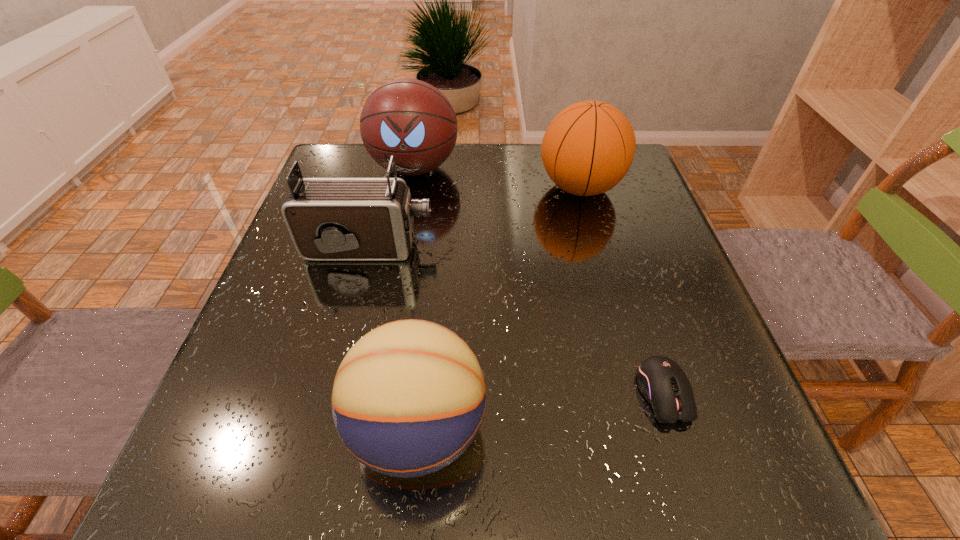
Locate an element on the screen. camcorder situated at the left edge is located at coordinates (329, 219).

The image size is (960, 540). I want to click on basketball that is at the right edge, so click(x=587, y=149).

The width and height of the screenshot is (960, 540). What are the coordinates of `computer mouse located at the right edge` in the screenshot? It's located at point(663,383).

Image resolution: width=960 pixels, height=540 pixels. In order to click on object present at the far left corner in this screenshot , I will do `click(408, 118)`.

The width and height of the screenshot is (960, 540). What are the coordinates of `object at the far right corner` in the screenshot? It's located at (587, 149).

The height and width of the screenshot is (540, 960). In the image, there is a desktop. What are the coordinates of `free region at the far edge` in the screenshot? It's located at (385, 178).

The width and height of the screenshot is (960, 540). In the image, there is a desktop. Find the location of `vacant space at the right edge`. vacant space at the right edge is located at coordinates (669, 314).

At what (x,y) coordinates should I click in order to perform the action: click on vacant region at the near left corner of the desktop. Please return your answer as a coordinate pair (x, y). The height and width of the screenshot is (540, 960). Looking at the image, I should click on (212, 463).

This screenshot has height=540, width=960. In order to click on vacant space in between the nearest basketball and the computer mouse in this screenshot , I will do `click(540, 411)`.

I want to click on vacant space in between the shortest object and the third nearest object, so click(x=516, y=321).